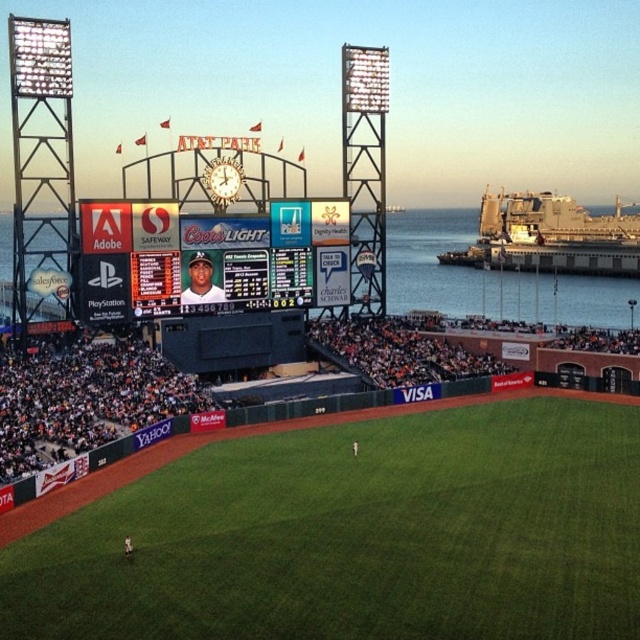
Question: Which object is farther from the camera taking this photo?

Choices:
 (A) matte black scoreboard at center
 (B) transparent glass water at upper center

Answer: (B)

Question: Is matte black scoreboard at center to the right of transparent glass water at upper center from the viewer's perspective?

Choices:
 (A) yes
 (B) no

Answer: (B)

Question: Is matte black scoreboard at center behind transparent glass water at upper center?

Choices:
 (A) yes
 (B) no

Answer: (B)

Question: Among these points, which one is farthest from the camera?

Choices:
 (A) tap(262, 304)
 (B) tap(616, 323)

Answer: (B)

Question: Can you confirm if matte black scoreboard at center is positioned to the left of transparent glass water at upper center?

Choices:
 (A) yes
 (B) no

Answer: (A)